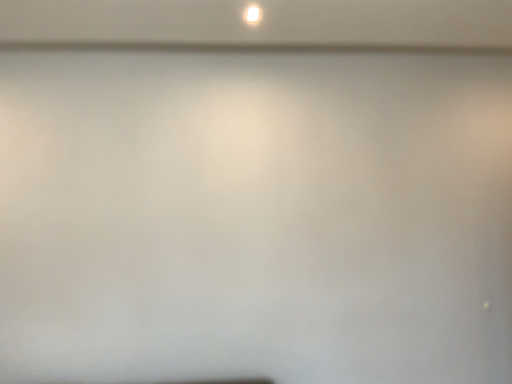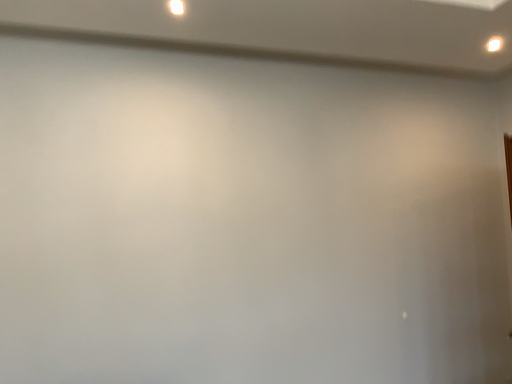
Question: How did the camera likely rotate when shooting the video?

Choices:
 (A) rotated left
 (B) rotated right

Answer: (B)